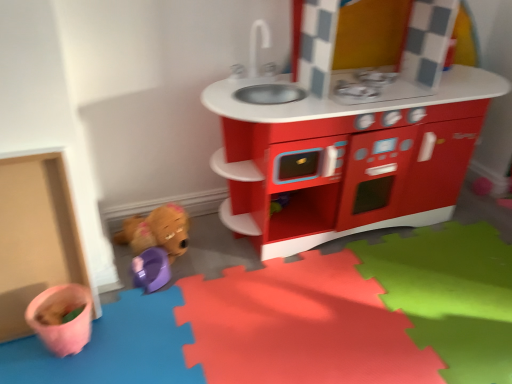
Where is `empty space that is to the right of brown plush toy at lower left, which is the first toy from top to bottom`? empty space that is to the right of brown plush toy at lower left, which is the first toy from top to bottom is located at coordinates pos(211,263).